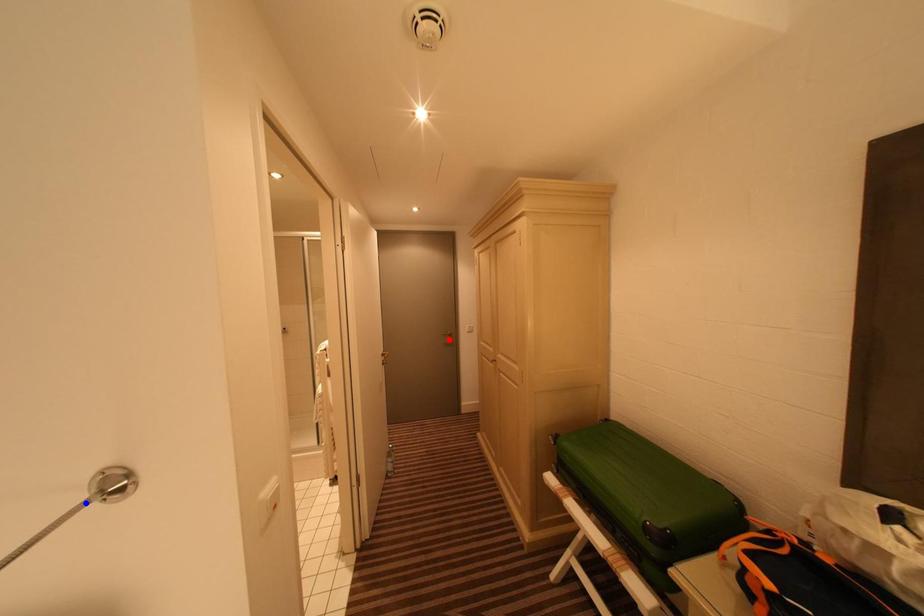
Question: Two points are marked on the image. Which point is closer to the camera?

Choices:
 (A) Blue point is closer.
 (B) Red point is closer.

Answer: (A)